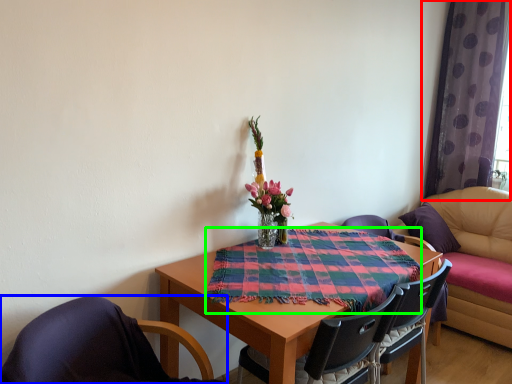
Question: Considering the real-world distances, which object is closest to curtain (highlighted by a red box)? chair (highlighted by a blue box) or cloth (highlighted by a green box).

Choices:
 (A) chair
 (B) cloth

Answer: (B)